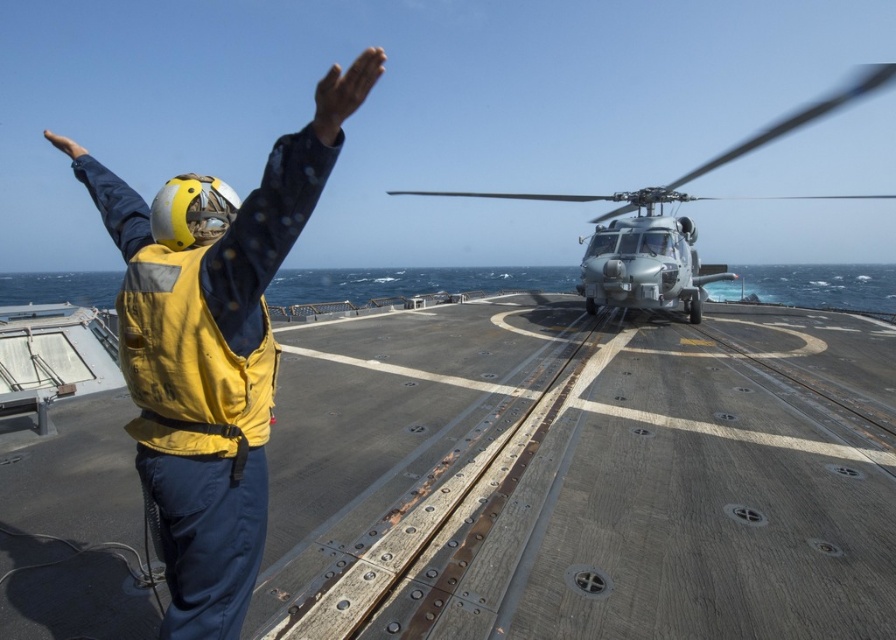
Question: Can you confirm if yellow fabric vest at left is smaller than silver metallic helicopter at center?

Choices:
 (A) yes
 (B) no

Answer: (A)

Question: Is yellow fabric vest at left smaller than silver metallic helicopter at center?

Choices:
 (A) yes
 (B) no

Answer: (A)

Question: Is yellow fabric vest at left wider than silver metallic helicopter at center?

Choices:
 (A) yes
 (B) no

Answer: (B)